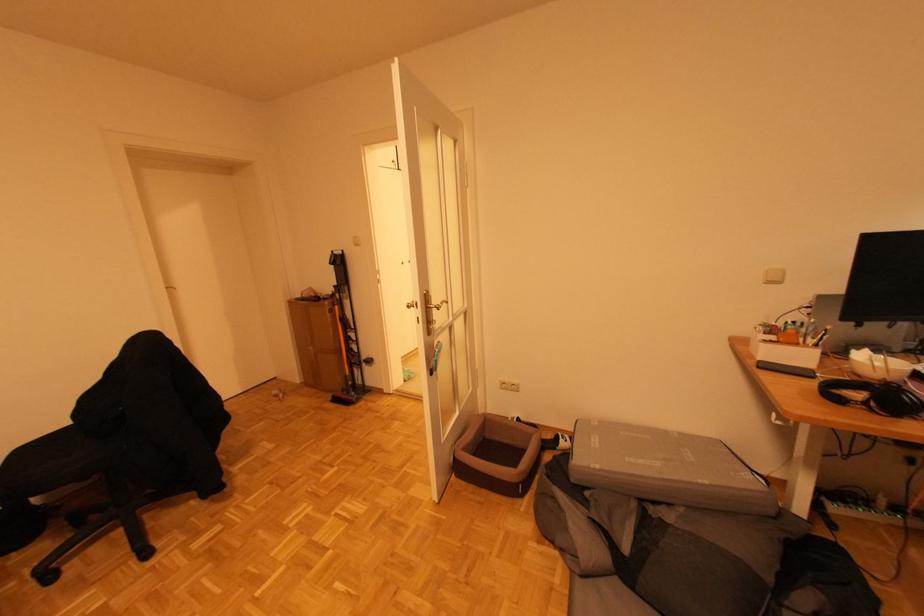
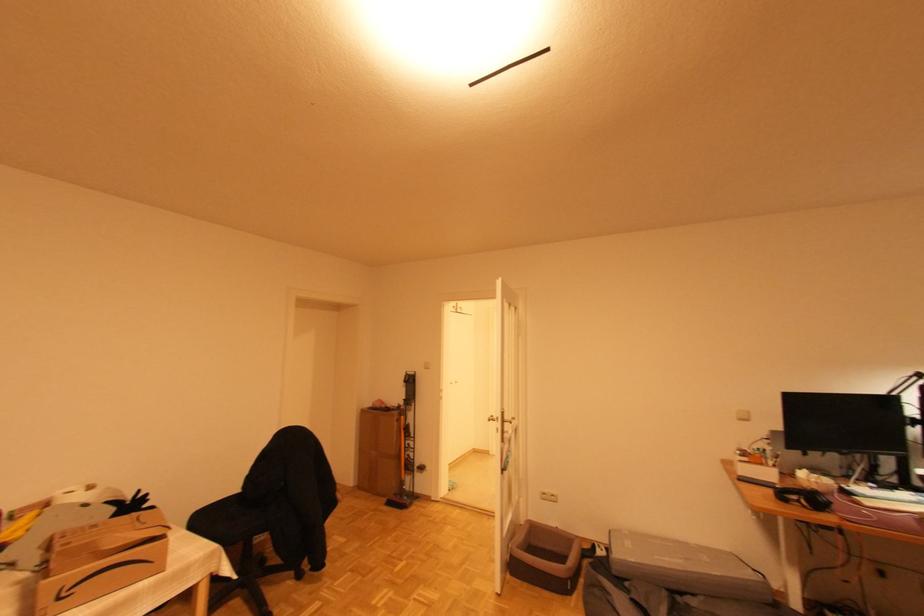
Locate, in the second image, the point that corresponds to (454,329) in the first image.

(513, 440)